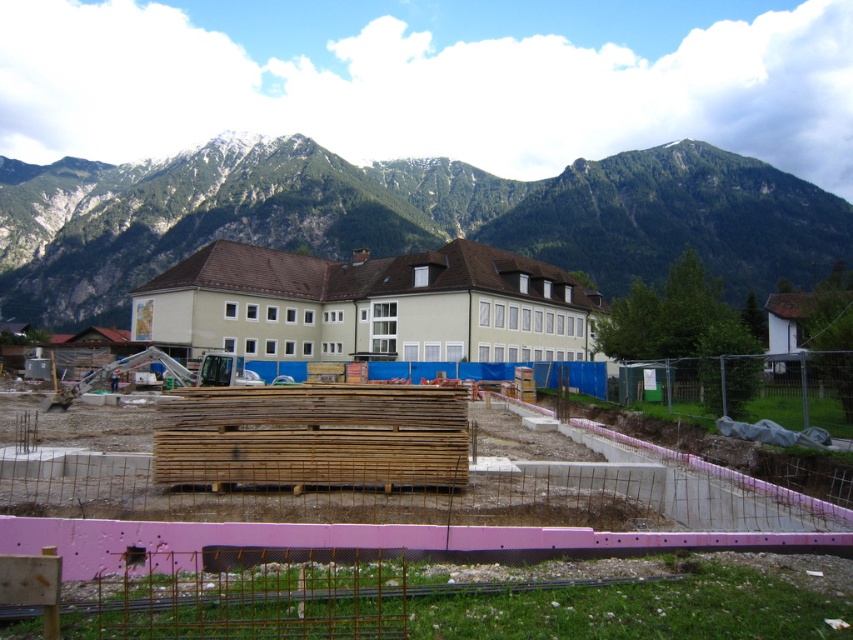
Is point (405, 401) more distant than point (606, 250)?

No, (405, 401) is closer to viewer.

Is point (244, 541) closer to viewer compared to point (721, 168)?

Yes, it is in front of point (721, 168).

What do you see at coordinates (354, 509) in the screenshot?
I see `wooden planks at center` at bounding box center [354, 509].

Identify the location of wooden planks at center. (354, 509).